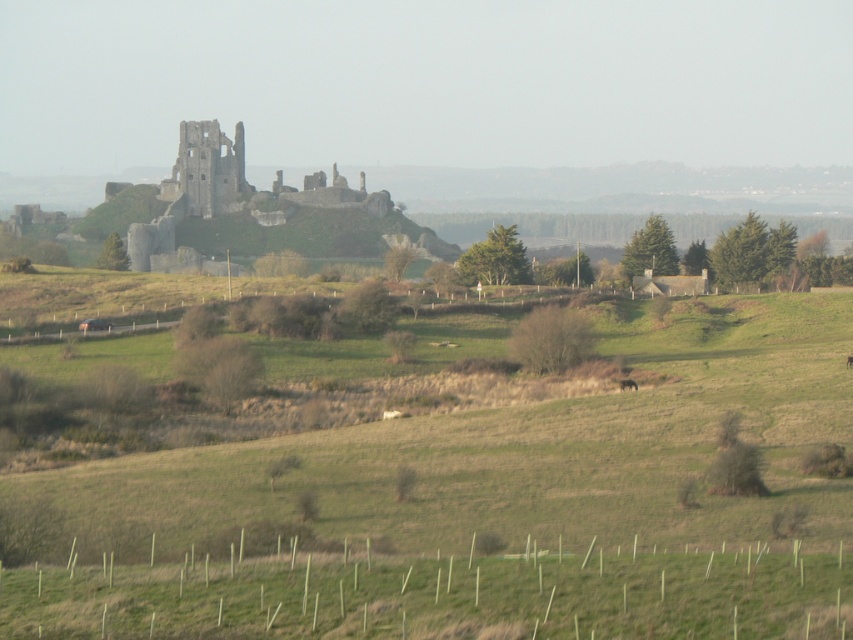
Question: Which of the following is the farthest from the observer?

Choices:
 (A) green grassy at lower center
 (B) brown furry dog at center-right

Answer: (B)

Question: Does green grassy at lower center appear on the right side of brown furry dog at center-right?

Choices:
 (A) no
 (B) yes

Answer: (A)

Question: Does green grassy at lower center appear under brown furry dog at center-right?

Choices:
 (A) yes
 (B) no

Answer: (A)

Question: Which object is closer to the camera taking this photo?

Choices:
 (A) green grassy at lower center
 (B) weathered stone castle at center
 (C) brown furry dog at center-right

Answer: (A)

Question: Among these objects, which one is nearest to the camera?

Choices:
 (A) weathered stone castle at center
 (B) green grassy at lower center
 (C) brown furry dog at center-right

Answer: (B)

Question: Is green grassy at lower center positioned behind brown furry dog at center-right?

Choices:
 (A) no
 (B) yes

Answer: (A)